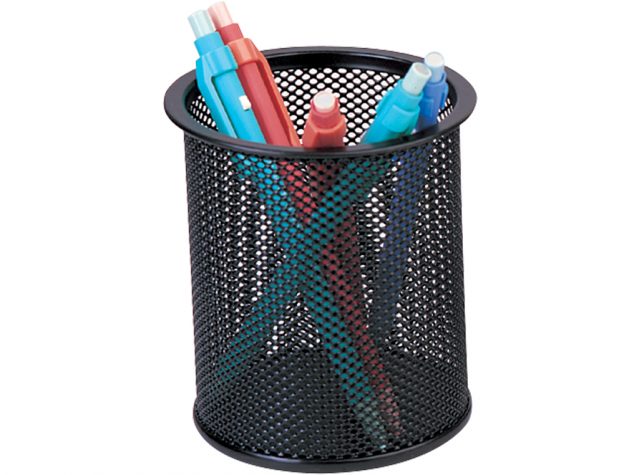
Locate an element on the screen. The image size is (624, 475). pens is located at coordinates (441, 97), (415, 103), (327, 120), (263, 65), (223, 82).